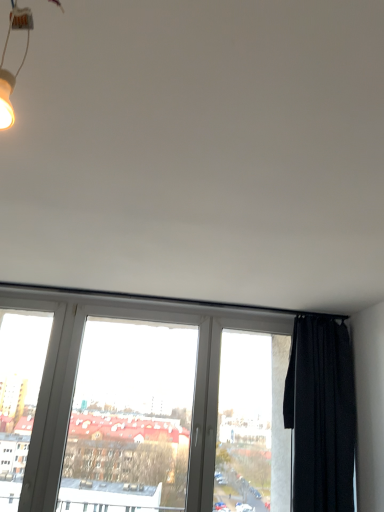
Measure the distance between point (76, 424) and camera.

The distance of point (76, 424) from camera is 9.55 feet.

Locate an element on the screen. Image resolution: width=384 pixels, height=512 pixels. white plastic window at center is located at coordinates (162, 406).

Consider the image. Is black matte curtain at right outside of white plastic window at center?

Indeed, black matte curtain at right is completely outside white plastic window at center.

Is point (353, 452) positioned in front of point (176, 431)?

Yes, point (353, 452) is in front of point (176, 431).

Considering the sizes of objects black matte curtain at right and white plastic window at center in the image provided, who is bigger, black matte curtain at right or white plastic window at center?

Bigger between the two is white plastic window at center.

Considering their positions, is black matte curtain at right located in front of or behind white plastic window at center?

In the image, black matte curtain at right appears in front of white plastic window at center.

Which point is more distant from viewer, (97, 402) or (285, 403)?

The point (97, 402) is farther from the camera.

Would you say white plastic window at center is to the left or to the right of black matte curtain at right in the picture?

Clearly, white plastic window at center is on the left of black matte curtain at right in the image.

Consider the image. Between white plastic window at center and black matte curtain at right, which one has less height?

black matte curtain at right is shorter.

Which object is closer to the camera taking this photo, white plastic window at center or black matte curtain at right?

black matte curtain at right.

Is white plastic window frame at left taller than black matte curtain at right?

Yes, white plastic window frame at left is taller than black matte curtain at right.

Which object is further away from the camera taking this photo, white plastic window frame at left or black matte curtain at right?

white plastic window frame at left is further away from the camera.

Can you confirm if white plastic window frame at left is thinner than black matte curtain at right?

Indeed, white plastic window frame at left has a lesser width compared to black matte curtain at right.

Based on the photo, is black matte curtain at right oriented towards white plastic window frame at left?

No, black matte curtain at right is not turned towards white plastic window frame at left.

Locate an element on the screen. Image resolution: width=384 pixels, height=512 pixels. curtain above the white plastic window frame at left (from a real-world perspective) is located at coordinates (321, 415).

Is white plastic window frame at left at the right side of white plastic window at center?

In fact, white plastic window frame at left is to the left of white plastic window at center.

Are white plastic window frame at left and white plastic window at center beside each other?

No, white plastic window frame at left is not in contact with white plastic window at center.

Is white plastic window frame at left closer to the viewer compared to white plastic window at center?

No, white plastic window frame at left is behind white plastic window at center.

Who is bigger, white plastic window frame at left or white plastic window at center?

white plastic window at center is bigger.

Is white plastic window at center smaller than white plastic window frame at left?

Incorrect, white plastic window at center is not smaller in size than white plastic window frame at left.

Is point (143, 340) farther from viewer compared to point (7, 439)?

Yes, point (143, 340) is farther from viewer.

Is white plastic window at center inside or outside of white plastic window frame at left?

The correct answer is: outside.

Locate an element on the screen. The width and height of the screenshot is (384, 512). curtain in front of the white plastic window at center is located at coordinates [x=321, y=415].

Locate an element on the screen. Image resolution: width=384 pixels, height=512 pixels. window that appears on the left of black matte curtain at right is located at coordinates (162, 406).

Looking at the image, which one is located closer to black matte curtain at right, white plastic window frame at left or white plastic window at center?

white plastic window at center.

Which object lies nearer to the anchor point black matte curtain at right, white plastic window at center or white plastic window frame at left?

The object closer to black matte curtain at right is white plastic window at center.

From the image, which object appears to be nearer to white plastic window at center, black matte curtain at right or white plastic window frame at left?

black matte curtain at right.

Considering their positions, is black matte curtain at right positioned closer to white plastic window frame at left than white plastic window at center?

white plastic window at center is positioned closer to the anchor white plastic window frame at left.

Which object lies nearer to the anchor point white plastic window at center, white plastic window frame at left or black matte curtain at right?

black matte curtain at right is positioned closer to the anchor white plastic window at center.

When comparing their distances from white plastic window frame at left, does white plastic window at center or black matte curtain at right seem closer?

white plastic window at center is closer to white plastic window frame at left.

Find the location of a particular element. This screenshot has height=512, width=384. window situated between white plastic window frame at left and black matte curtain at right from left to right is located at coordinates (162, 406).